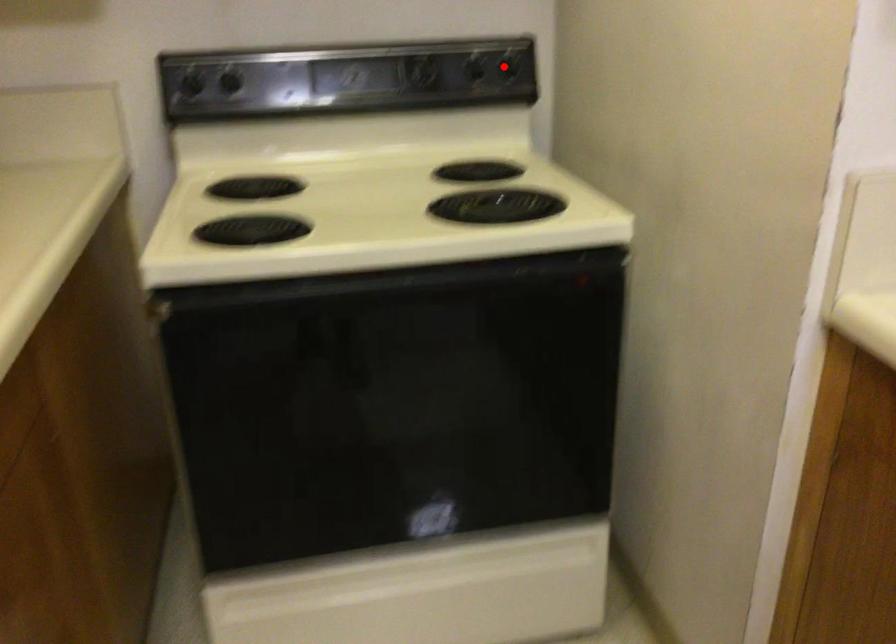
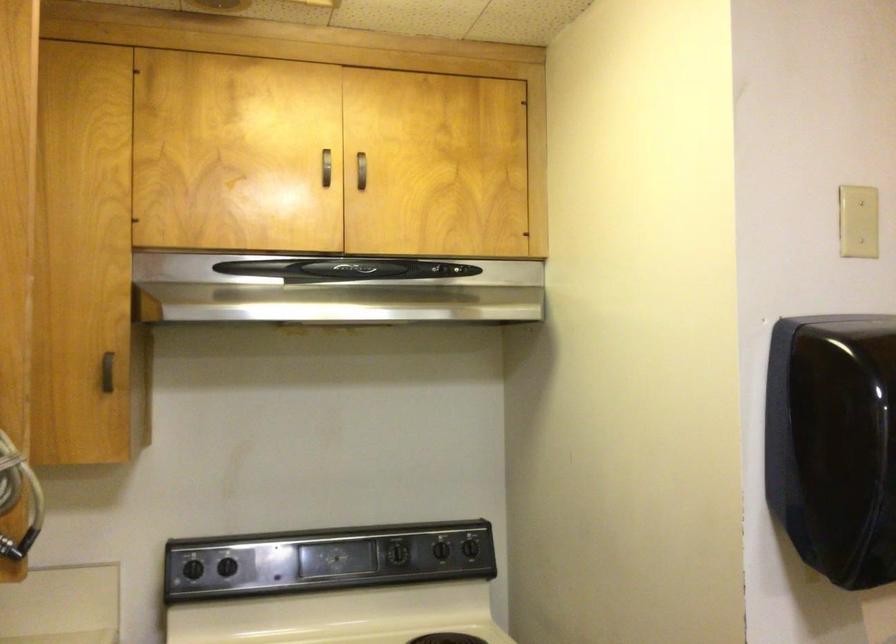
The point at the highlighted location is marked in the first image. Where is the corresponding point in the second image?

(470, 547)